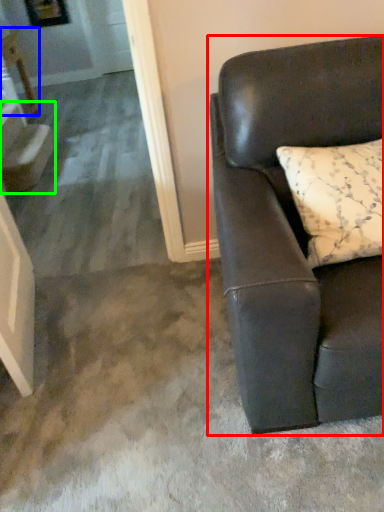
Question: Which object is the closest to the studio couch (highlighted by a red box)? Choose among these: table (highlighted by a blue box) or stairwell (highlighted by a green box).

Choices:
 (A) table
 (B) stairwell

Answer: (B)